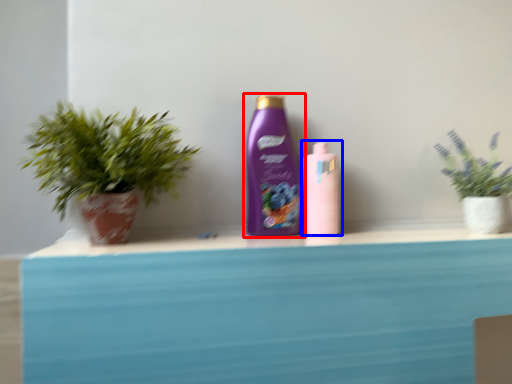
Question: Which point is closer to the camera, bottle (highlighted by a red box) or bottle (highlighted by a blue box)?

Choices:
 (A) bottle
 (B) bottle

Answer: (A)